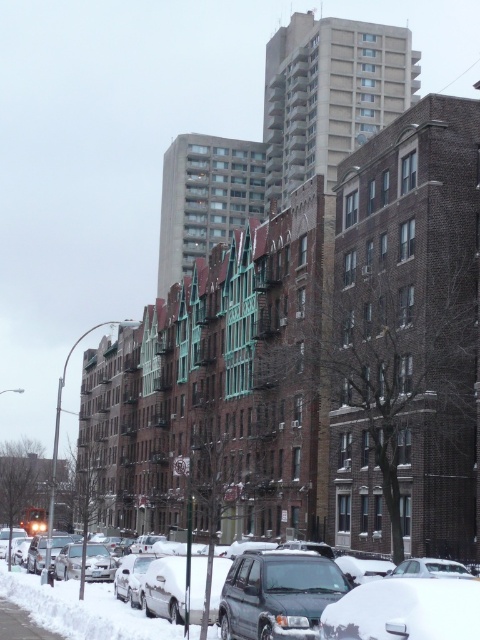
Question: Among these points, which one is farthest from the camera?

Choices:
 (A) (305, 628)
 (B) (180, 628)

Answer: (B)

Question: Is dark green matte suv at center positioned before snow-covered suv at center?

Choices:
 (A) no
 (B) yes

Answer: (B)

Question: Can you confirm if dark green matte suv at center is positioned above snow-covered suv at center?

Choices:
 (A) no
 (B) yes

Answer: (B)

Question: Among these objects, which one is farthest from the camera?

Choices:
 (A) snow-covered suv at center
 (B) dark green matte suv at center

Answer: (A)

Question: Can you confirm if dark green matte suv at center is wider than snow-covered suv at center?

Choices:
 (A) yes
 (B) no

Answer: (B)